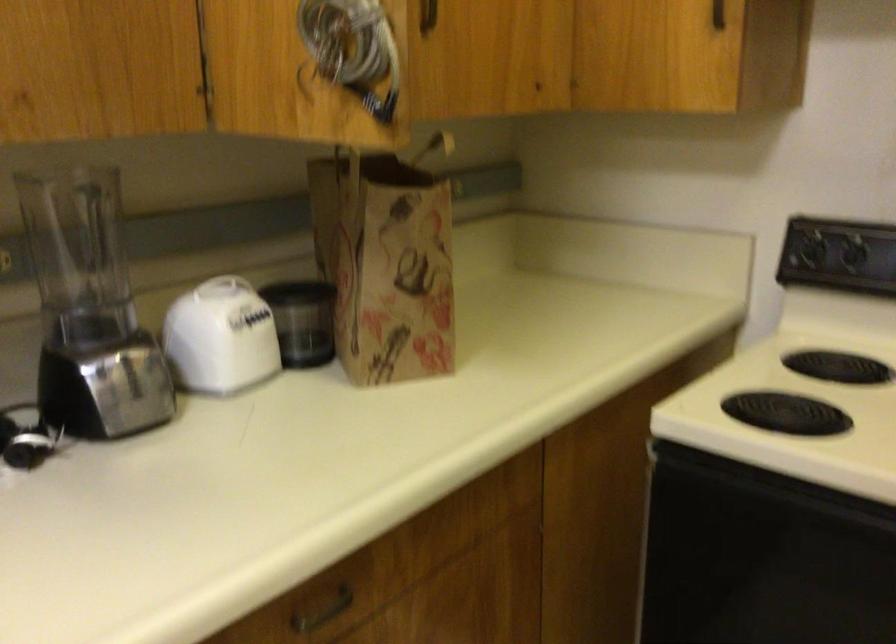
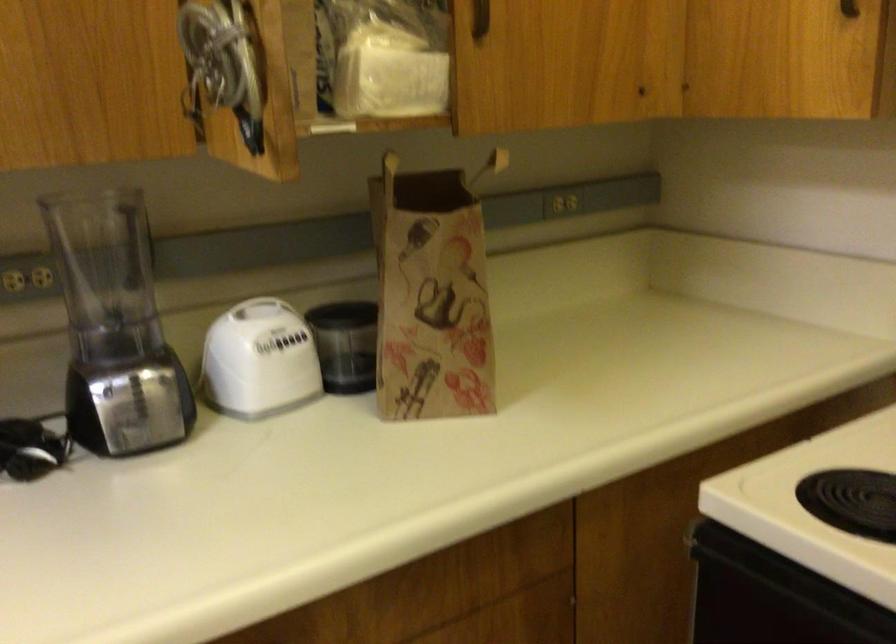
Find the pixel in the second image that matches pixel 142 375 in the first image.

(149, 395)